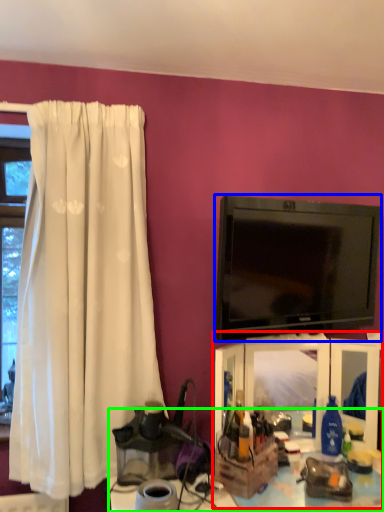
Question: Which object is positioned closest to entertainment center (highlighted by a red box)? Select from television (highlighted by a blue box) and table (highlighted by a green box).

Choices:
 (A) television
 (B) table

Answer: (B)